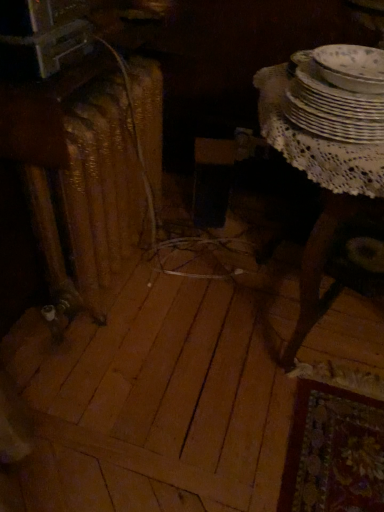
Measure the distance between point (372, 48) and camera.

Point (372, 48) is 33.94 inches from camera.

What is the approximate height of porcelain plates at upper right, which ranks as the 2th tableware in top-to-bottom order?

porcelain plates at upper right, which ranks as the 2th tableware in top-to-bottom order, is 4.62 inches tall.

What is the approximate width of white porcelain plates at upper right, acting as the 2th tableware starting from the bottom?

white porcelain plates at upper right, acting as the 2th tableware starting from the bottom, is 7.71 inches in width.

Image resolution: width=384 pixels, height=512 pixels. What do you see at coordinates (351, 67) in the screenshot? I see `white porcelain plates at upper right, the first tableware viewed from the top` at bounding box center [351, 67].

I want to click on white lace table at right, so point(321,187).

From a real-world perspective, is porcelain plates at upper right, the 1th tableware from the bottom, physically located above or below white lace table at right?

porcelain plates at upper right, the 1th tableware from the bottom, is situated higher than white lace table at right in the real world.

How many degrees apart are the facing directions of porcelain plates at upper right, which ranks as the 2th tableware in top-to-bottom order, and white lace table at right?

The angle between the facing direction of porcelain plates at upper right, which ranks as the 2th tableware in top-to-bottom order, and the facing direction of white lace table at right is 4.45 degrees.

Which is correct: porcelain plates at upper right, the 1th tableware from the bottom, is inside white lace table at right, or outside of it?

porcelain plates at upper right, the 1th tableware from the bottom, is spatially situated outside white lace table at right.

Is porcelain plates at upper right, which ranks as the 2th tableware in top-to-bottom order, turned away from white lace table at right?

porcelain plates at upper right, which ranks as the 2th tableware in top-to-bottom order, does not have its back to white lace table at right.

Would you say porcelain plates at upper right, which ranks as the 2th tableware in top-to-bottom order, is outside rusty metal radiator at left?

That's correct, porcelain plates at upper right, which ranks as the 2th tableware in top-to-bottom order, is outside of rusty metal radiator at left.

From the image's perspective, which object appears higher, porcelain plates at upper right, which ranks as the 2th tableware in top-to-bottom order, or rusty metal radiator at left?

porcelain plates at upper right, which ranks as the 2th tableware in top-to-bottom order.

Is porcelain plates at upper right, which ranks as the 2th tableware in top-to-bottom order, positioned behind rusty metal radiator at left?

No, it is not.

Is white porcelain plates at upper right, acting as the 2th tableware starting from the bottom, located outside porcelain plates at upper right, the 1th tableware from the bottom?

Absolutely, white porcelain plates at upper right, acting as the 2th tableware starting from the bottom, is external to porcelain plates at upper right, the 1th tableware from the bottom.

Is white porcelain plates at upper right, acting as the 2th tableware starting from the bottom, positioned with its back to porcelain plates at upper right, which ranks as the 2th tableware in top-to-bottom order?

No, porcelain plates at upper right, which ranks as the 2th tableware in top-to-bottom order, is not at the back of white porcelain plates at upper right, acting as the 2th tableware starting from the bottom.

Is white porcelain plates at upper right, acting as the 2th tableware starting from the bottom, not close to porcelain plates at upper right, the 1th tableware from the bottom?

That's not correct — white porcelain plates at upper right, acting as the 2th tableware starting from the bottom, is a little close to porcelain plates at upper right, the 1th tableware from the bottom.

In terms of size, does white lace table at right appear bigger or smaller than white porcelain plates at upper right, the first tableware viewed from the top?

Considering their sizes, white lace table at right takes up more space than white porcelain plates at upper right, the first tableware viewed from the top.

From the picture: How many degrees apart are the facing directions of white lace table at right and white porcelain plates at upper right, the first tableware viewed from the top?

There is a 4.45-degree angle between the facing directions of white lace table at right and white porcelain plates at upper right, the first tableware viewed from the top.

From the image's perspective, between white lace table at right and white porcelain plates at upper right, acting as the 2th tableware starting from the bottom, who is located below?

From the image's view, white lace table at right is below.

In the scene shown: From a real-world perspective, which object rests below the other?

white lace table at right, from a real-world perspective.

Which is correct: rusty metal radiator at left is inside white lace table at right, or outside of it?

rusty metal radiator at left is not inside white lace table at right, it's outside.

From a real-world perspective, between rusty metal radiator at left and white lace table at right, who is vertically higher?

From a 3D spatial view, white lace table at right is above.

The width and height of the screenshot is (384, 512). In order to click on table on the right side of rusty metal radiator at left in this screenshot , I will do `click(321, 187)`.

How different are the orientations of porcelain plates at upper right, the 1th tableware from the bottom, and white porcelain plates at upper right, the first tableware viewed from the top, in degrees?

They differ by 0.000558 degrees in their facing directions.

In the image, is porcelain plates at upper right, the 1th tableware from the bottom, on the left side or the right side of white porcelain plates at upper right, acting as the 2th tableware starting from the bottom?

Result: In the image, porcelain plates at upper right, the 1th tableware from the bottom, appears on the left side of white porcelain plates at upper right, acting as the 2th tableware starting from the bottom.

Could white porcelain plates at upper right, the first tableware viewed from the top, be considered to be inside porcelain plates at upper right, the 1th tableware from the bottom?

No, porcelain plates at upper right, the 1th tableware from the bottom, does not contain white porcelain plates at upper right, the first tableware viewed from the top.

Is point (332, 100) closer or farther from the camera than point (349, 81)?

Point (332, 100) is closer to the camera than point (349, 81).

Based on the photo, does rusty metal radiator at left have a lesser height compared to porcelain plates at upper right, the 1th tableware from the bottom?

No.

Is rusty metal radiator at left wider or thinner than porcelain plates at upper right, which ranks as the 2th tableware in top-to-bottom order?

In the image, rusty metal radiator at left appears to be wider than porcelain plates at upper right, which ranks as the 2th tableware in top-to-bottom order.

From a real-world perspective, which is physically below, rusty metal radiator at left or porcelain plates at upper right, the 1th tableware from the bottom?

From a 3D spatial view, rusty metal radiator at left is below.

Does point (92, 152) come closer to viewer compared to point (372, 82)?

No.

Find the location of a particular element. table in front of the porcelain plates at upper right, the 1th tableware from the bottom is located at coordinates (321, 187).

Identify the location of radiator on the left of porcelain plates at upper right, the 1th tableware from the bottom. Image resolution: width=384 pixels, height=512 pixels. (99, 188).

Considering their positions, is porcelain plates at upper right, the 1th tableware from the bottom, positioned further to white porcelain plates at upper right, acting as the 2th tableware starting from the bottom, than white lace table at right?

white lace table at right.

Looking at the image, which one is located closer to rusty metal radiator at left, white porcelain plates at upper right, the first tableware viewed from the top, or white lace table at right?

Based on the image, white lace table at right appears to be nearer to rusty metal radiator at left.

Looking at the image, which one is located closer to white lace table at right, porcelain plates at upper right, the 1th tableware from the bottom, or white porcelain plates at upper right, acting as the 2th tableware starting from the bottom?

The object closer to white lace table at right is porcelain plates at upper right, the 1th tableware from the bottom.

When comparing their distances from porcelain plates at upper right, which ranks as the 2th tableware in top-to-bottom order, does rusty metal radiator at left or white lace table at right seem closer?

white lace table at right is positioned closer to the anchor porcelain plates at upper right, which ranks as the 2th tableware in top-to-bottom order.

Consider the image. Looking at the image, which one is located further to white lace table at right, porcelain plates at upper right, the 1th tableware from the bottom, or rusty metal radiator at left?

rusty metal radiator at left is positioned further to the anchor white lace table at right.

From the image, which object appears to be nearer to rusty metal radiator at left, white lace table at right or porcelain plates at upper right, which ranks as the 2th tableware in top-to-bottom order?

white lace table at right is positioned closer to the anchor rusty metal radiator at left.

From the image, which object appears to be farther from white lace table at right, rusty metal radiator at left or white porcelain plates at upper right, the first tableware viewed from the top?

The object further to white lace table at right is rusty metal radiator at left.

Considering their positions, is porcelain plates at upper right, the 1th tableware from the bottom, positioned further to white porcelain plates at upper right, acting as the 2th tableware starting from the bottom, than rusty metal radiator at left?

The object further to white porcelain plates at upper right, acting as the 2th tableware starting from the bottom, is rusty metal radiator at left.

The height and width of the screenshot is (512, 384). Find the location of `tableware between white porcelain plates at upper right, the first tableware viewed from the top, and white lace table at right from top to bottom`. tableware between white porcelain plates at upper right, the first tableware viewed from the top, and white lace table at right from top to bottom is located at coordinates (338, 93).

This screenshot has width=384, height=512. I want to click on tableware between rusty metal radiator at left and white porcelain plates at upper right, acting as the 2th tableware starting from the bottom, so click(x=338, y=93).